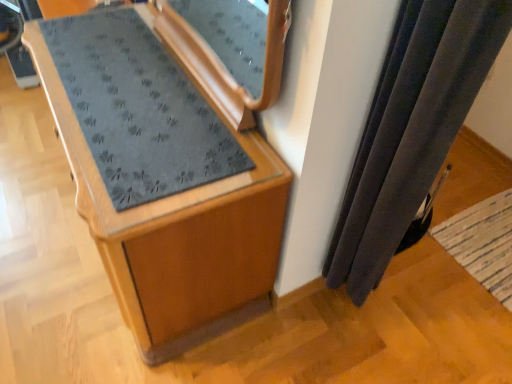
Question: Is velvet dark gray curtain at right bigger or smaller than woven beige mat at lower right?

Choices:
 (A) small
 (B) big

Answer: (B)

Question: Considering the positions of velvet dark gray curtain at right and woven beige mat at lower right in the image, is velvet dark gray curtain at right taller or shorter than woven beige mat at lower right?

Choices:
 (A) tall
 (B) short

Answer: (A)

Question: Which is farther from the velvet dark gray curtain at right?

Choices:
 (A) woven beige mat at lower right
 (B) wooden cabinet at center

Answer: (A)

Question: Which of these objects is positioned farthest from the woven beige mat at lower right?

Choices:
 (A) velvet dark gray curtain at right
 (B) wooden cabinet at center

Answer: (B)